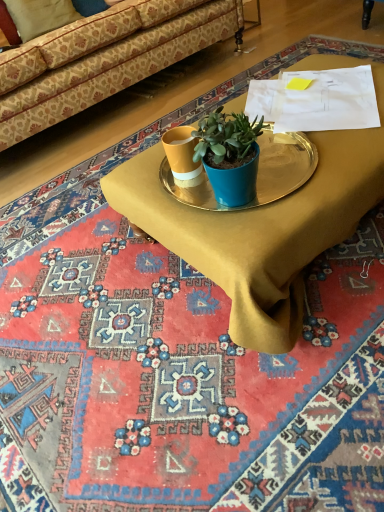
Question: Is patterned fabric couch at upper left smaller than metallic gold tray at center?

Choices:
 (A) yes
 (B) no

Answer: (B)

Question: From a real-world perspective, is patterned fabric couch at upper left below metallic gold tray at center?

Choices:
 (A) yes
 (B) no

Answer: (B)

Question: From the image's perspective, does patterned fabric couch at upper left appear lower than metallic gold tray at center?

Choices:
 (A) no
 (B) yes

Answer: (A)

Question: Is patterned fabric couch at upper left looking in the opposite direction of metallic gold tray at center?

Choices:
 (A) yes
 (B) no

Answer: (B)

Question: From a real-world perspective, is patterned fabric couch at upper left on top of metallic gold tray at center?

Choices:
 (A) no
 (B) yes

Answer: (B)

Question: Looking at the image, does metallic gold tray at center seem bigger or smaller compared to beige fabric pillow at upper left?

Choices:
 (A) big
 (B) small

Answer: (A)

Question: Based on their positions, is metallic gold tray at center located to the left or right of beige fabric pillow at upper left?

Choices:
 (A) right
 (B) left

Answer: (A)

Question: Is metallic gold tray at center wider or thinner than beige fabric pillow at upper left?

Choices:
 (A) wide
 (B) thin

Answer: (A)

Question: Is metallic gold tray at center situated inside beige fabric pillow at upper left or outside?

Choices:
 (A) outside
 (B) inside

Answer: (A)

Question: Considering the positions of metallic gold tray at center and metallic gold tray at center in the image, is metallic gold tray at center wider or thinner than metallic gold tray at center?

Choices:
 (A) thin
 (B) wide

Answer: (B)

Question: Relative to metallic gold tray at center, is metallic gold tray at center in front or behind?

Choices:
 (A) behind
 (B) front

Answer: (B)

Question: From the image's perspective, is metallic gold tray at center located above or below metallic gold tray at center?

Choices:
 (A) above
 (B) below

Answer: (A)

Question: In terms of height, does metallic gold tray at center look taller or shorter compared to metallic gold tray at center?

Choices:
 (A) tall
 (B) short

Answer: (A)

Question: Would you say metallic gold tray at center is to the left or to the right of metallic gold tray at center in the picture?

Choices:
 (A) left
 (B) right

Answer: (A)

Question: In terms of height, does metallic gold tray at center look taller or shorter compared to metallic gold tray at center?

Choices:
 (A) short
 (B) tall

Answer: (A)